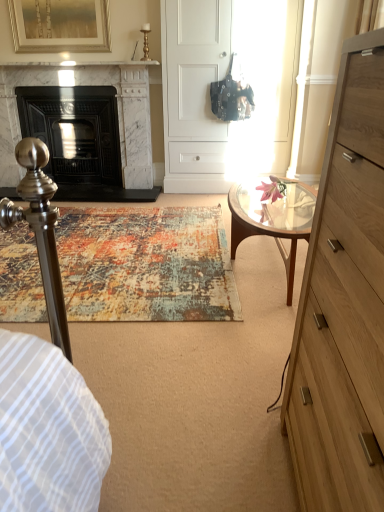
What is the approximate width of light brown wood chest of drawers at right?

13.68 inches.

Measure the distance between light brown wood chest of drawers at right and camera.

A distance of 24.97 inches exists between light brown wood chest of drawers at right and camera.

The image size is (384, 512). In order to click on gold-framed artwork at upper left in this screenshot , I will do `click(60, 25)`.

I want to click on light brown wood chest of drawers at right, so click(x=343, y=304).

Is white marble fireplace at left, which is the 2th fireplace from left to right, outside of light brown wood chest of drawers at right?

Indeed, white marble fireplace at left, which is the 2th fireplace from left to right, is completely outside light brown wood chest of drawers at right.

Is white marble fireplace at left, which is the 2th fireplace from left to right, aimed at light brown wood chest of drawers at right?

Yes.

Is white marble fireplace at left, which is the 2th fireplace from left to right, far from light brown wood chest of drawers at right?

white marble fireplace at left, which is the 2th fireplace from left to right, is positioned a significant distance from light brown wood chest of drawers at right.

Measure the distance from light brown wood chest of drawers at right to white marble fireplace at left, which is the 2th fireplace from left to right.

light brown wood chest of drawers at right and white marble fireplace at left, which is the 2th fireplace from left to right, are 3.49 meters apart from each other.

Considering the positions of objects light brown wood chest of drawers at right and white marble fireplace at left, which is the 2th fireplace from left to right, in the image provided, who is more to the right, light brown wood chest of drawers at right or white marble fireplace at left, which is the 2th fireplace from left to right,?

From the viewer's perspective, light brown wood chest of drawers at right appears more on the right side.

Does light brown wood chest of drawers at right have a larger size compared to white marble fireplace at left, which is counted as the first fireplace, starting from the right?

Actually, light brown wood chest of drawers at right might be smaller than white marble fireplace at left, which is counted as the first fireplace, starting from the right.

From the image's perspective, which one is positioned higher, light brown wood chest of drawers at right or white marble fireplace at left, which is counted as the first fireplace, starting from the right?

white marble fireplace at left, which is counted as the first fireplace, starting from the right, from the image's perspective.

Is light brown wood chest of drawers at right wider or thinner than gold-framed artwork at upper left?

Clearly, light brown wood chest of drawers at right has more width compared to gold-framed artwork at upper left.

Based on the photo, looking at the image, does light brown wood chest of drawers at right seem bigger or smaller compared to gold-framed artwork at upper left?

Clearly, light brown wood chest of drawers at right is larger in size than gold-framed artwork at upper left.

Is light brown wood chest of drawers at right positioned with its back to gold-framed artwork at upper left?

light brown wood chest of drawers at right is not turned away from gold-framed artwork at upper left.

Which object is positioned more to the right, light brown wood chest of drawers at right or gold-framed artwork at upper left?

Positioned to the right is light brown wood chest of drawers at right.

From a real-world perspective, is clear glass coffee table at center on top of white marble fireplace at left, which is counted as the first fireplace, starting from the right?

No, from a real-world perspective, clear glass coffee table at center is not on top of white marble fireplace at left, which is counted as the first fireplace, starting from the right.

Is point (290, 291) closer or farther from the camera than point (30, 70)?

Point (290, 291) is closer to the camera than point (30, 70).

From the image's perspective, between clear glass coffee table at center and white marble fireplace at left, which is the 2th fireplace from left to right, who is located below?

clear glass coffee table at center.

From the image's perspective, is gold-framed artwork at upper left under matte black fireplace at left, which is the second fireplace from right to left?

No, from the image's perspective, gold-framed artwork at upper left is not beneath matte black fireplace at left, which is the second fireplace from right to left.

I want to click on picture frame above the matte black fireplace at left, which is the second fireplace from right to left (from the image's perspective), so click(x=60, y=25).

Can matte black fireplace at left, which is counted as the first fireplace, starting from the left, be found inside gold-framed artwork at upper left?

That's incorrect, matte black fireplace at left, which is counted as the first fireplace, starting from the left, is not inside gold-framed artwork at upper left.

Considering the relative positions of gold-framed artwork at upper left and matte black fireplace at left, which is counted as the first fireplace, starting from the left, in the image provided, is gold-framed artwork at upper left to the right of matte black fireplace at left, which is counted as the first fireplace, starting from the left, from the viewer's perspective?

Incorrect, gold-framed artwork at upper left is not on the right side of matte black fireplace at left, which is counted as the first fireplace, starting from the left.

Does clear glass coffee table at center come in front of gold-framed artwork at upper left?

Yes, it is.

From a real-world perspective, is clear glass coffee table at center physically above gold-framed artwork at upper left?

No, from a real-world perspective, clear glass coffee table at center is not over gold-framed artwork at upper left

Is clear glass coffee table at center inside the boundaries of gold-framed artwork at upper left, or outside?

clear glass coffee table at center is not enclosed by gold-framed artwork at upper left.

In order to click on coffee table directly beneath the gold-framed artwork at upper left (from a real-world perspective) in this screenshot , I will do `click(273, 220)`.

Is gold-framed artwork at upper left oriented away from light brown wood chest of drawers at right?

No, gold-framed artwork at upper left is not facing the opposite direction of light brown wood chest of drawers at right.

In the image, there is a gold-framed artwork at upper left. Where is `the chest of drawers below it (from the image's perspective)`? the chest of drawers below it (from the image's perspective) is located at coordinates (343, 304).

From the image's perspective, which is below, gold-framed artwork at upper left or light brown wood chest of drawers at right?

light brown wood chest of drawers at right is shown below in the image.

Would you say light brown wood chest of drawers at right is part of gold-framed artwork at upper left's contents?

No.

From a real-world perspective, which fireplace is the 1st one underneath the light brown wood chest of drawers at right? Please provide its 2D coordinates.

[(76, 87)]

Where is `the 1st fireplace behind the light brown wood chest of drawers at right, starting your count from the anchor`? The image size is (384, 512). the 1st fireplace behind the light brown wood chest of drawers at right, starting your count from the anchor is located at coordinates (76, 87).

Looking at the image, which one is located closer to gold-framed artwork at upper left, clear glass coffee table at center or white marble fireplace at left, which is counted as the first fireplace, starting from the right?

Based on the image, white marble fireplace at left, which is counted as the first fireplace, starting from the right, appears to be nearer to gold-framed artwork at upper left.

Based on their spatial positions, is clear glass coffee table at center or gold-framed artwork at upper left further from light brown wood chest of drawers at right?

Among the two, gold-framed artwork at upper left is located further to light brown wood chest of drawers at right.

Looking at the image, which one is located further to gold-framed artwork at upper left, light brown wood chest of drawers at right or white marble fireplace at left, which is counted as the first fireplace, starting from the right?

Based on the image, light brown wood chest of drawers at right appears to be further to gold-framed artwork at upper left.

Estimate the real-world distances between objects in this image. Which object is closer to matte black fireplace at left, which is counted as the first fireplace, starting from the left, gold-framed artwork at upper left or clear glass coffee table at center?

The object closer to matte black fireplace at left, which is counted as the first fireplace, starting from the left, is gold-framed artwork at upper left.

Looking at the image, which one is located further to matte black fireplace at left, which is the second fireplace from right to left, white marble fireplace at left, which is counted as the first fireplace, starting from the right, or gold-framed artwork at upper left?

gold-framed artwork at upper left is further to matte black fireplace at left, which is the second fireplace from right to left.

Estimate the real-world distances between objects in this image. Which object is further from gold-framed artwork at upper left, light brown wood chest of drawers at right or clear glass coffee table at center?

light brown wood chest of drawers at right.

Looking at the image, which one is located further to gold-framed artwork at upper left, matte black fireplace at left, which is the second fireplace from right to left, or light brown wood chest of drawers at right?

Among the two, light brown wood chest of drawers at right is located further to gold-framed artwork at upper left.

Which object lies nearer to the anchor point gold-framed artwork at upper left, white marble fireplace at left, which is the 2th fireplace from left to right, or light brown wood chest of drawers at right?

Among the two, white marble fireplace at left, which is the 2th fireplace from left to right, is located nearer to gold-framed artwork at upper left.

I want to click on picture frame between clear glass coffee table at center and white marble fireplace at left, which is counted as the first fireplace, starting from the right, from front to back, so click(60, 25).

Identify the location of coffee table between light brown wood chest of drawers at right and matte black fireplace at left, which is counted as the first fireplace, starting from the left, from front to back. The height and width of the screenshot is (512, 384). (273, 220).

The image size is (384, 512). I want to click on fireplace positioned between light brown wood chest of drawers at right and matte black fireplace at left, which is counted as the first fireplace, starting from the left, from near to far, so click(76, 87).

Identify the location of fireplace between clear glass coffee table at center and matte black fireplace at left, which is counted as the first fireplace, starting from the left, along the z-axis. (76, 87).